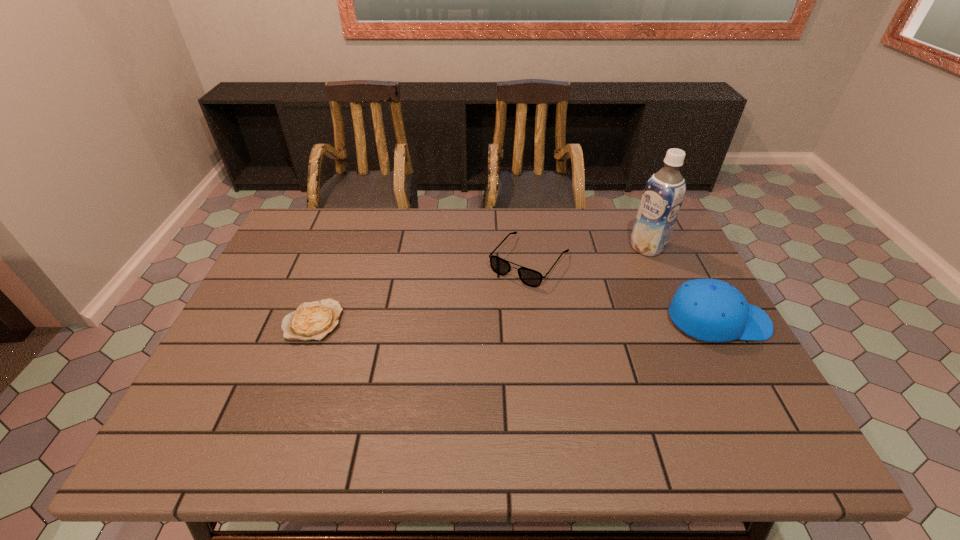
In order to click on the shortest object in this screenshot , I will do `click(314, 320)`.

I want to click on the leftmost object, so click(x=314, y=320).

At what (x,y) coordinates should I click in order to perform the action: click on cap. Please return your answer as a coordinate pair (x, y). The width and height of the screenshot is (960, 540). Looking at the image, I should click on (711, 310).

Where is `spectacles`? This screenshot has height=540, width=960. spectacles is located at coordinates (530, 277).

Find the location of a particular element. the second shortest object is located at coordinates (530, 277).

Locate an element on the screen. The image size is (960, 540). the tallest object is located at coordinates (664, 192).

You are a GUI agent. You are given a task and a screenshot of the screen. Output one action in this format:
    pyautogui.click(x=<x>, y=<y>)
    Task: Click on the free space located 0.110m on the back of the shortest object
    The width and height of the screenshot is (960, 540).
    Given the screenshot: What is the action you would take?
    pyautogui.click(x=331, y=273)

Where is `free space located 0.360m on the front-facing side of the spectacles`? The height and width of the screenshot is (540, 960). free space located 0.360m on the front-facing side of the spectacles is located at coordinates (436, 377).

You are a GUI agent. You are given a task and a screenshot of the screen. Output one action in this format:
    pyautogui.click(x=<x>, y=<y>)
    Task: Click on the vacant point located on the front-facing side of the spectacles
    The image size is (960, 540).
    Given the screenshot: What is the action you would take?
    pyautogui.click(x=462, y=345)

Identify the location of vacant space located on the front-facing side of the spectacles. (451, 359).